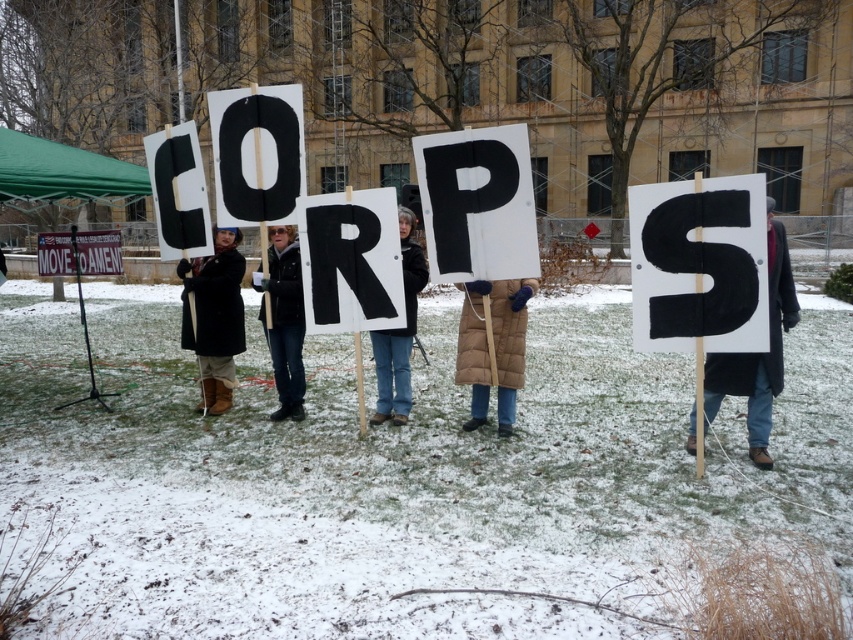
You are a photographer trying to capture a clear photo of the brown puffy coat at center and the white cardboard sign at center. Which object should you focus on first to ensure both are in frame?

The brown puffy coat at center is located below the white cardboard sign at center, so you should focus on the white cardboard sign at center first to ensure both are in frame.